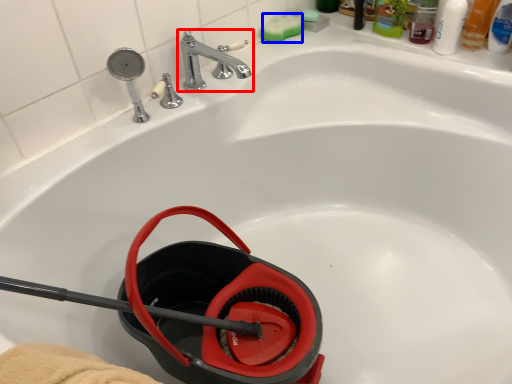
Question: Which of the following is the closest to the observer, tap (highlighted by a red box) or soap (highlighted by a blue box)?

Choices:
 (A) tap
 (B) soap

Answer: (A)